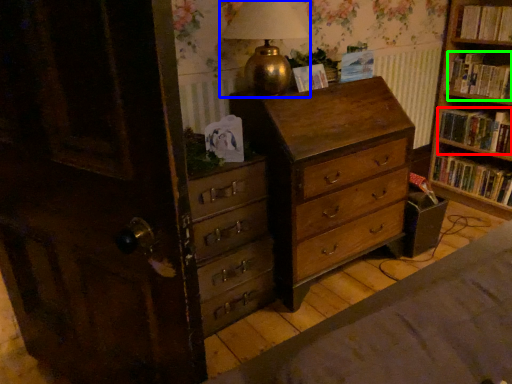
Question: Which object is positioned closest to book (highlighted by a red box)? Select from table lamp (highlighted by a blue box) and book (highlighted by a green box).

Choices:
 (A) table lamp
 (B) book

Answer: (B)